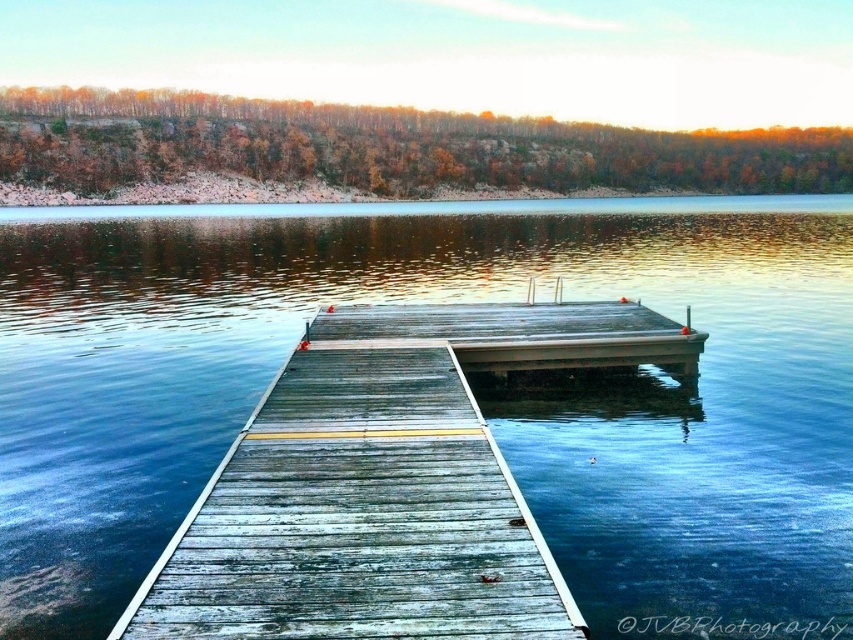
Question: In this image, where is transparent blue water at center located relative to weathered wood dock at center?

Choices:
 (A) below
 (B) above

Answer: (B)

Question: Which object appears farthest from the camera in this image?

Choices:
 (A) weathered wood dock at center
 (B) transparent blue water at center

Answer: (B)

Question: Observing the image, what is the correct spatial positioning of transparent blue water at center in reference to weathered wood dock at center?

Choices:
 (A) below
 (B) above

Answer: (B)

Question: Which object is farther from the camera taking this photo?

Choices:
 (A) weathered wood dock at center
 (B) transparent blue water at center

Answer: (B)

Question: Does transparent blue water at center come in front of weathered wood dock at center?

Choices:
 (A) no
 (B) yes

Answer: (A)